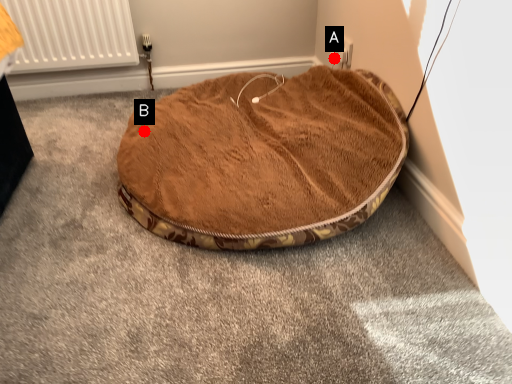
Question: Two points are circled on the image, labeled by A and B beside each circle. Which point is further to the camera?

Choices:
 (A) A is further
 (B) B is further

Answer: (A)